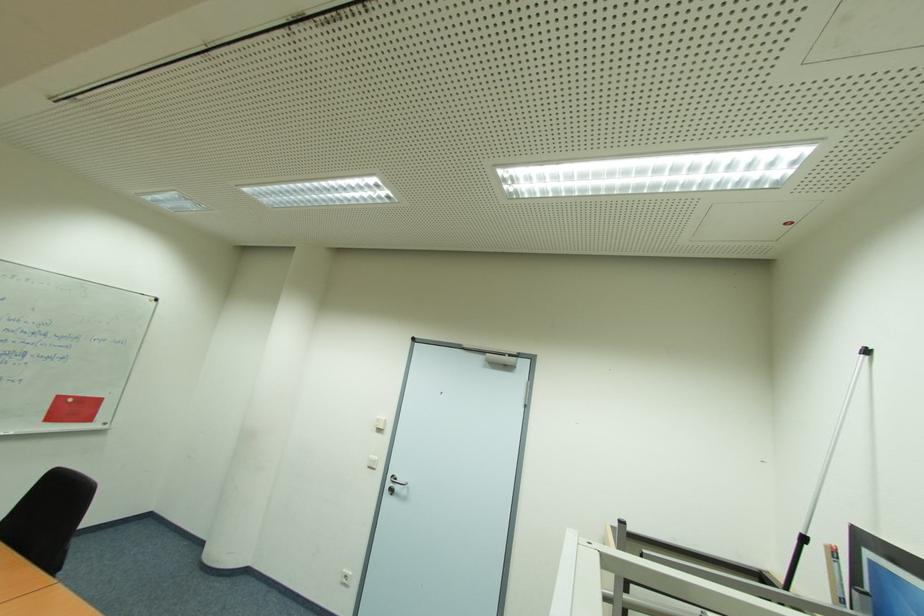
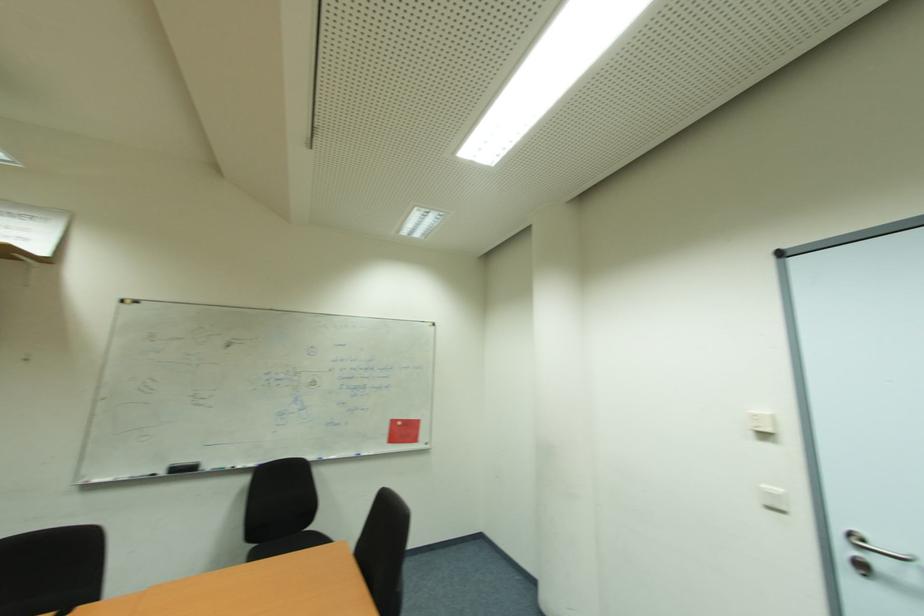
Where in the second image is the point corresponding to (395,492) from the first image?

(869, 570)